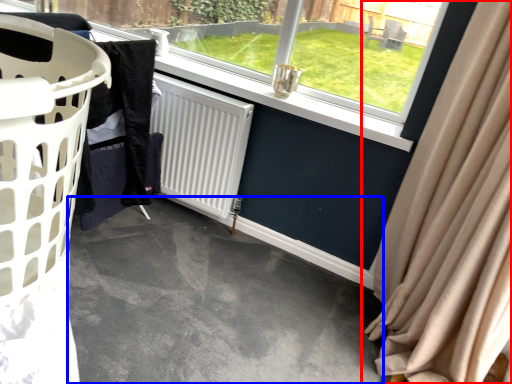
Question: Which object appears closest to the camera in this image, curtain (highlighted by a red box) or concrete (highlighted by a blue box)?

Choices:
 (A) curtain
 (B) concrete

Answer: (A)